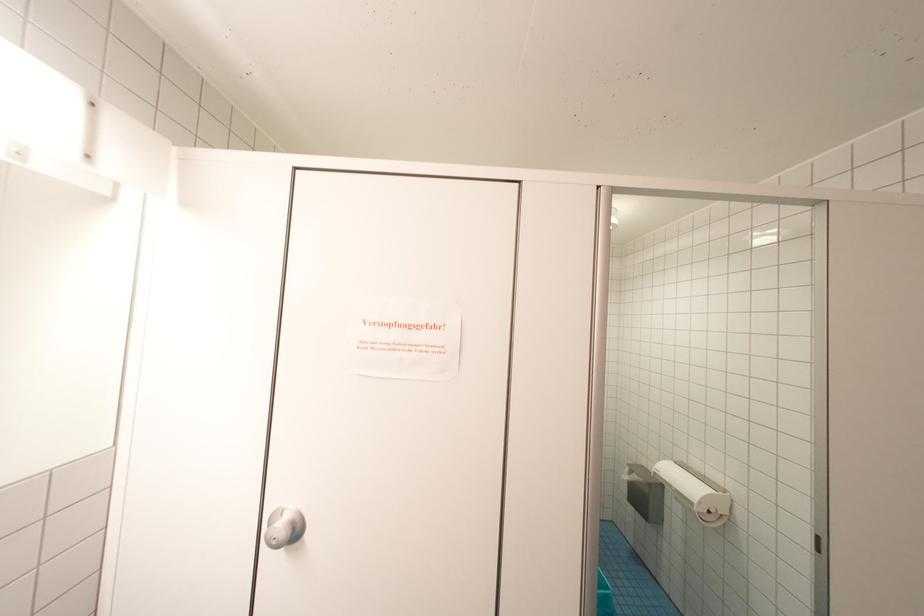
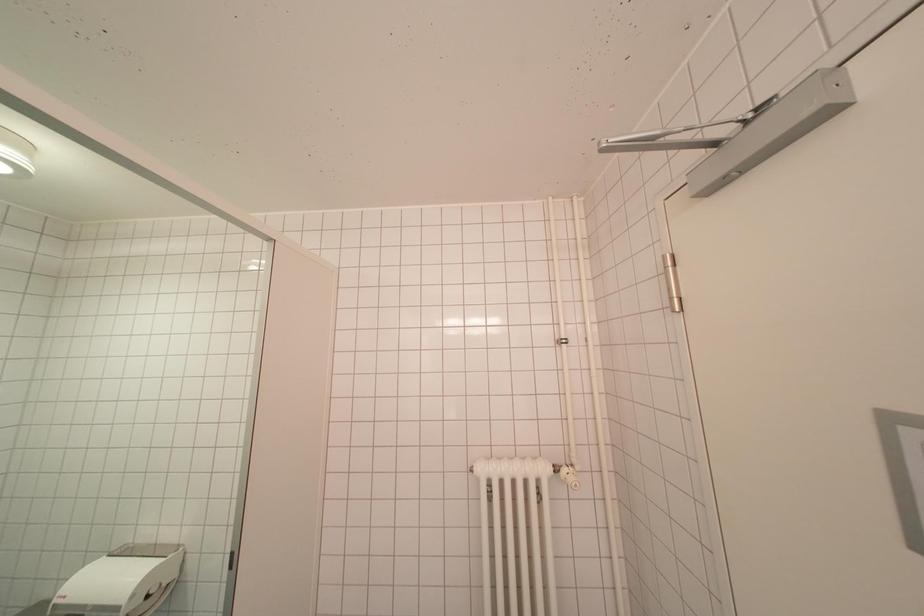
Question: The camera is either moving clockwise (left) or counter-clockwise (right) around the object. The first image is from the beginning of the video and the second image is from the end. Is the camera moving left or right when shooting the video?

Choices:
 (A) Left
 (B) Right

Answer: (A)